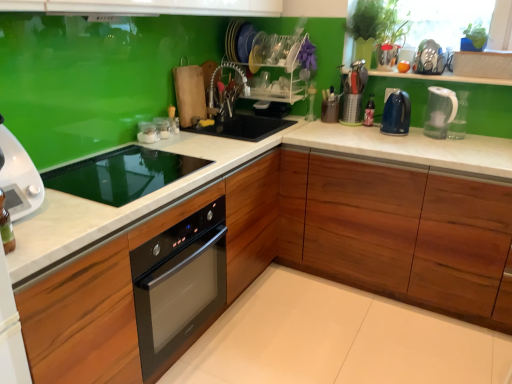
Identify the location of free space above wooden cabinet at lower right, which ranks as the 1th cabinetry in right-to-left order (from a real-world perspective). (442, 142).